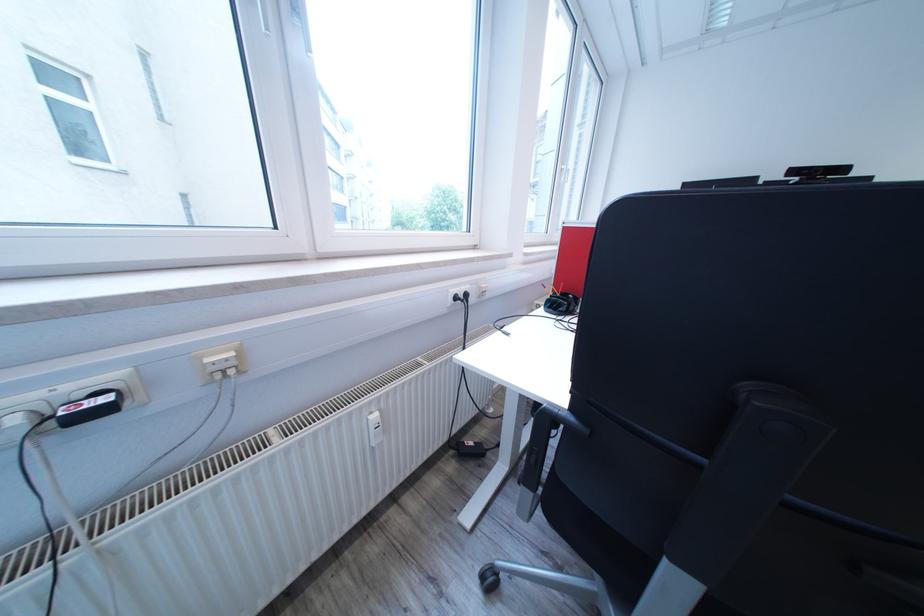
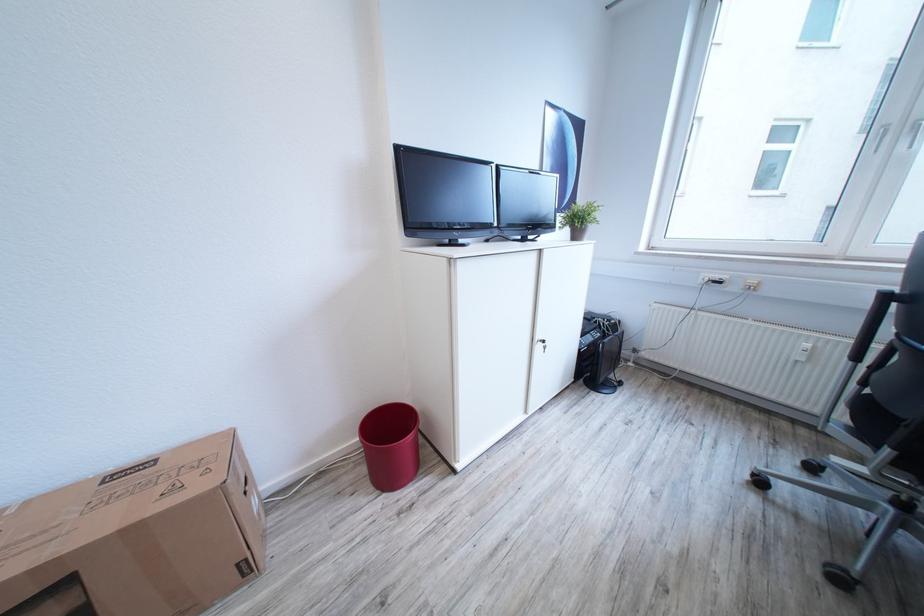
In the second image, find the point that corresponds to [217,362] in the first image.

(759, 284)